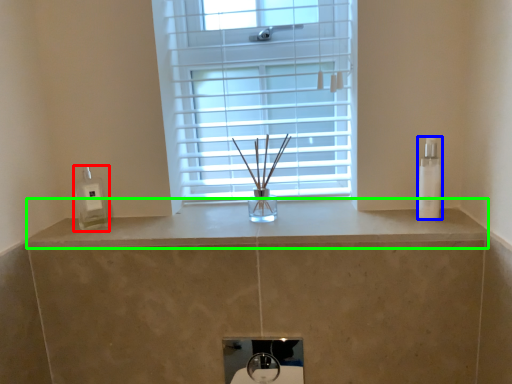
Question: Which object is positioned farthest from soap dispenser (highlighted by a red box)? Select from toiletry (highlighted by a blue box) and counter top (highlighted by a green box).

Choices:
 (A) toiletry
 (B) counter top

Answer: (A)